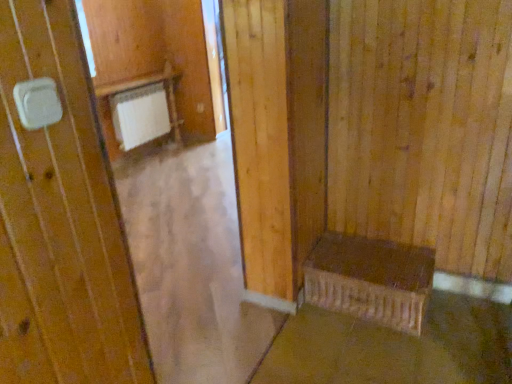
This screenshot has width=512, height=384. Describe the element at coordinates (370, 280) in the screenshot. I see `brown wooden bench at lower right` at that location.

At what (x,y) coordinates should I click in order to perform the action: click on brown wooden bench at lower right. Please return your answer as a coordinate pair (x, y). This screenshot has width=512, height=384. Looking at the image, I should click on (370, 280).

This screenshot has height=384, width=512. Describe the element at coordinates (395, 347) in the screenshot. I see `brown concrete at lower right` at that location.

Find the location of `brown concrete at lower right`. brown concrete at lower right is located at coordinates (395, 347).

In order to face brown concrete at lower right, should I rotate leftwards or rightwards?

To face it directly, rotate right by 18.383 degrees.

Locate an element on the screen. brown wooden bench at lower right is located at coordinates (370, 280).

Does brown concrete at lower right appear on the right side of brown wooden bench at lower right?

Indeed, brown concrete at lower right is positioned on the right side of brown wooden bench at lower right.

Which object is closer to the camera taking this photo, brown concrete at lower right or brown wooden bench at lower right?

brown concrete at lower right is closer to the camera.

Which is less distant, (449, 311) or (425, 288)?

Point (449, 311) appears to be farther away from the viewer than point (425, 288).

Based on the photo, from the image's perspective, does brown concrete at lower right appear lower than brown wooden bench at lower right?

Yes, from the image's perspective, brown concrete at lower right is below brown wooden bench at lower right.

From a real-world perspective, is brown concrete at lower right physically located above or below brown wooden bench at lower right?

brown concrete at lower right is below brown wooden bench at lower right.

From the picture: Does brown concrete at lower right have a lesser width compared to brown wooden bench at lower right?

In fact, brown concrete at lower right might be wider than brown wooden bench at lower right.

Who is shorter, brown concrete at lower right or brown wooden bench at lower right?

With less height is brown concrete at lower right.

Considering the sizes of objects brown concrete at lower right and brown wooden bench at lower right in the image provided, who is bigger, brown concrete at lower right or brown wooden bench at lower right?

Bigger between the two is brown wooden bench at lower right.

Is brown concrete at lower right not inside brown wooden bench at lower right?

brown concrete at lower right lies outside brown wooden bench at lower right's area.

Is brown concrete at lower right touching brown wooden bench at lower right?

brown concrete at lower right is not next to brown wooden bench at lower right, and they're not touching.

Is brown wooden bench at lower right at the back of brown concrete at lower right?

No, brown concrete at lower right is not facing away from brown wooden bench at lower right.

What's the angular difference between brown concrete at lower right and brown wooden bench at lower right's facing directions?

The angular difference between brown concrete at lower right and brown wooden bench at lower right is 87.8 degrees.

Measure the distance between brown concrete at lower right and brown wooden bench at lower right.

The distance of brown concrete at lower right from brown wooden bench at lower right is 9.22 inches.

Locate an element on the screen. This screenshot has width=512, height=384. concrete located in front of the brown wooden bench at lower right is located at coordinates (395, 347).

Between brown wooden bench at lower right and brown concrete at lower right, which one appears on the left side from the viewer's perspective?

brown wooden bench at lower right.

Is the position of brown wooden bench at lower right less distant than that of brown concrete at lower right?

No, the depth of brown wooden bench at lower right is greater than that of brown concrete at lower right.

Considering the positions of point (346, 295) and point (426, 379), is point (346, 295) closer or farther from the camera than point (426, 379)?

Point (346, 295) appears to be farther away from the viewer than point (426, 379).

Consider the image. From the image's perspective, is brown wooden bench at lower right above brown concrete at lower right?

Yes, from the image's perspective, brown wooden bench at lower right is over brown concrete at lower right.

Based on the photo, from a real-world perspective, is brown wooden bench at lower right on top of brown concrete at lower right?

Yes, from a real-world perspective, brown wooden bench at lower right is over brown concrete at lower right

Considering the relative sizes of brown wooden bench at lower right and brown concrete at lower right in the image provided, is brown wooden bench at lower right thinner than brown concrete at lower right?

Yes, brown wooden bench at lower right is thinner than brown concrete at lower right.

Between brown wooden bench at lower right and brown concrete at lower right, which one has less height?

brown concrete at lower right.

Can you confirm if brown wooden bench at lower right is bigger than brown concrete at lower right?

Correct, brown wooden bench at lower right is larger in size than brown concrete at lower right.

Is brown wooden bench at lower right inside the boundaries of brown concrete at lower right, or outside?

brown wooden bench at lower right is not inside brown concrete at lower right, it's outside.

Is brown wooden bench at lower right positioned far away from brown concrete at lower right?

No, brown wooden bench at lower right is in close proximity to brown concrete at lower right.

Is brown wooden bench at lower right looking in the opposite direction of brown concrete at lower right?

No.

Measure the distance from brown wooden bench at lower right to brown concrete at lower right.

brown wooden bench at lower right is 9.22 inches away from brown concrete at lower right.

Image resolution: width=512 pixels, height=384 pixels. Identify the location of concrete on the right of brown wooden bench at lower right. (395, 347).

Identify the location of furniture on the left of brown concrete at lower right. Image resolution: width=512 pixels, height=384 pixels. (370, 280).

At what (x,y) coordinates should I click in order to perform the action: click on concrete lying on the right of brown wooden bench at lower right. Please return your answer as a coordinate pair (x, y). This screenshot has width=512, height=384. Looking at the image, I should click on (395, 347).